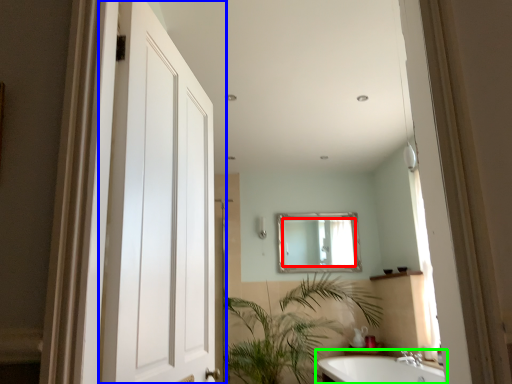
Question: Which is nearer to the mirror (highlighted by a red box)? door (highlighted by a blue box) or bathtub (highlighted by a green box).

Choices:
 (A) door
 (B) bathtub

Answer: (B)